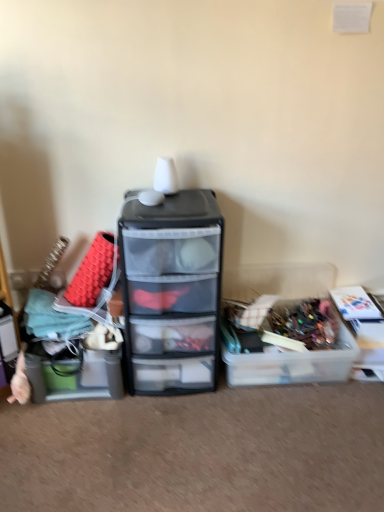
Question: From the image's perspective, is translucent plastic storage box at left, which appears as the 3th storage box when viewed from the right, on translucent plastic container at center-right, acting as the second storage box starting from the left?

Choices:
 (A) no
 (B) yes

Answer: (A)

Question: Would you say translucent plastic storage box at left, acting as the 1th storage box starting from the left, contains translucent plastic container at center-right, acting as the second storage box starting from the left?

Choices:
 (A) no
 (B) yes

Answer: (A)

Question: Can you confirm if translucent plastic storage box at left, which appears as the 3th storage box when viewed from the right, is thinner than translucent plastic container at center-right, which is counted as the second storage box, starting from the right?

Choices:
 (A) yes
 (B) no

Answer: (A)

Question: Does translucent plastic storage box at left, acting as the 1th storage box starting from the left, have a smaller size compared to translucent plastic container at center-right, acting as the second storage box starting from the left?

Choices:
 (A) yes
 (B) no

Answer: (A)

Question: Is the position of translucent plastic storage box at left, which appears as the 3th storage box when viewed from the right, more distant than that of translucent plastic container at center-right, which is counted as the second storage box, starting from the right?

Choices:
 (A) no
 (B) yes

Answer: (A)

Question: Considering the positions of point (49, 366) and point (334, 324), is point (49, 366) closer or farther from the camera than point (334, 324)?

Choices:
 (A) closer
 (B) farther

Answer: (A)

Question: From their relative heights in the image, would you say translucent plastic storage box at left, acting as the 1th storage box starting from the left, is taller or shorter than translucent plastic container at center-right, acting as the second storage box starting from the left?

Choices:
 (A) tall
 (B) short

Answer: (A)

Question: Is translucent plastic storage box at left, acting as the 1th storage box starting from the left, bigger or smaller than translucent plastic container at center-right, acting as the second storage box starting from the left?

Choices:
 (A) big
 (B) small

Answer: (B)

Question: Is translucent plastic storage box at left, acting as the 1th storage box starting from the left, wider or thinner than translucent plastic container at center-right, which is counted as the second storage box, starting from the right?

Choices:
 (A) thin
 (B) wide

Answer: (A)

Question: Looking at their shapes, would you say translucent plastic container at center-right, acting as the second storage box starting from the left, is wider or thinner than clear plastic storage box at right, which is the 3th storage box in left-to-right order?

Choices:
 (A) wide
 (B) thin

Answer: (A)

Question: Is translucent plastic container at center-right, which is counted as the second storage box, starting from the right, inside or outside of clear plastic storage box at right, which is the 1th storage box in right-to-left order?

Choices:
 (A) outside
 (B) inside

Answer: (A)

Question: From the image's perspective, is translucent plastic container at center-right, acting as the second storage box starting from the left, above or below clear plastic storage box at right, which is the 1th storage box in right-to-left order?

Choices:
 (A) below
 (B) above

Answer: (A)

Question: In the image, is translucent plastic container at center-right, which is counted as the second storage box, starting from the right, positioned in front of or behind clear plastic storage box at right, which is the 1th storage box in right-to-left order?

Choices:
 (A) behind
 (B) front

Answer: (B)

Question: From their relative heights in the image, would you say transparent plastic drawers at center is taller or shorter than clear plastic storage box at right, which is the 3th storage box in left-to-right order?

Choices:
 (A) short
 (B) tall

Answer: (B)

Question: From the image's perspective, is transparent plastic drawers at center above or below clear plastic storage box at right, which is the 1th storage box in right-to-left order?

Choices:
 (A) above
 (B) below

Answer: (A)